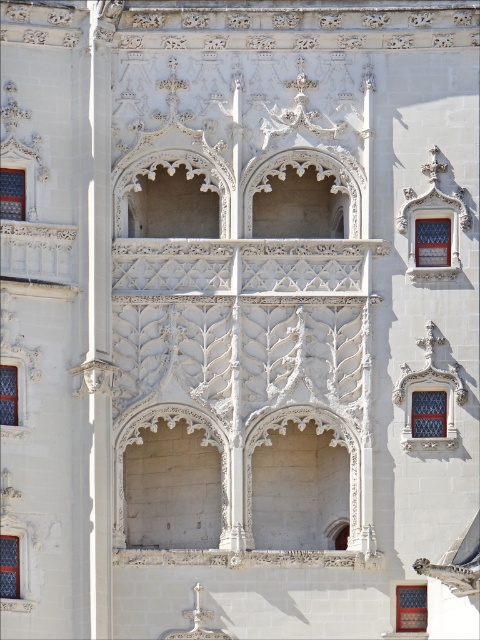
Question: Does matte glass window at center right have a larger size compared to blue glass window at center?

Choices:
 (A) no
 (B) yes

Answer: (B)

Question: Which point is closer to the camera?

Choices:
 (A) (0, 564)
 (B) (417, 612)

Answer: (A)

Question: Estimate the real-world distances between objects in this image. Which object is farther from the matte glass window at center?

Choices:
 (A) matte glass window at lower right
 (B) clear glass window at center

Answer: (B)

Question: Which of the following is the closest to the observer?

Choices:
 (A) (432, 246)
 (B) (429, 419)

Answer: (B)

Question: Is matte glass window at upper left to the left of matte glass window at center from the viewer's perspective?

Choices:
 (A) yes
 (B) no

Answer: (A)

Question: Does matte glass window at center right have a greater width compared to matte glass window at center left?

Choices:
 (A) yes
 (B) no

Answer: (A)